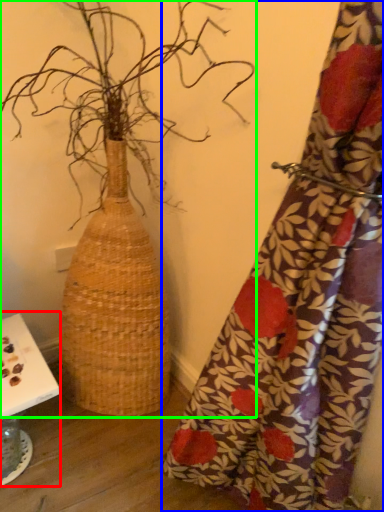
Question: Estimate the real-world distances between objects in this image. Which object is closer to table (highlighted by a red box), curtain (highlighted by a blue box) or houseplant (highlighted by a green box)?

Choices:
 (A) curtain
 (B) houseplant

Answer: (B)